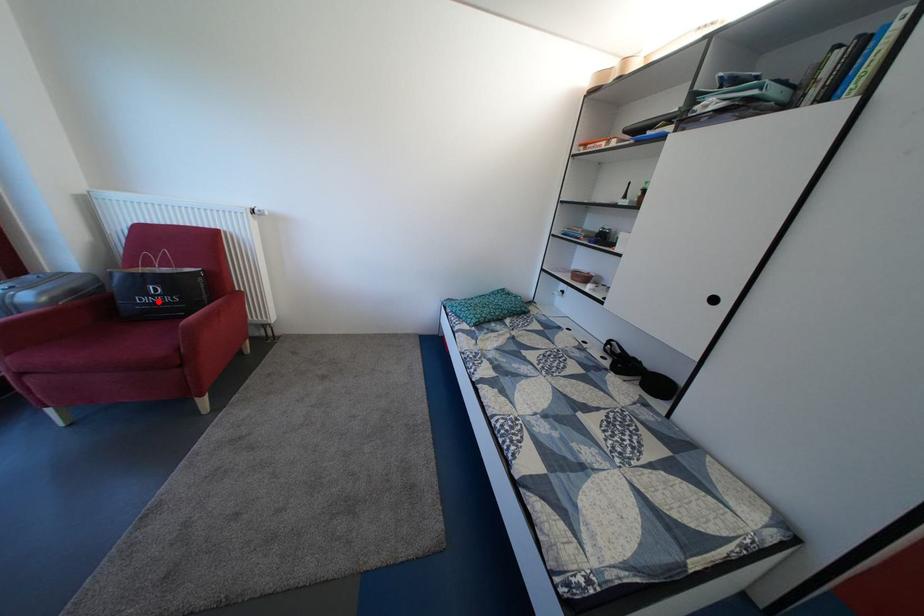
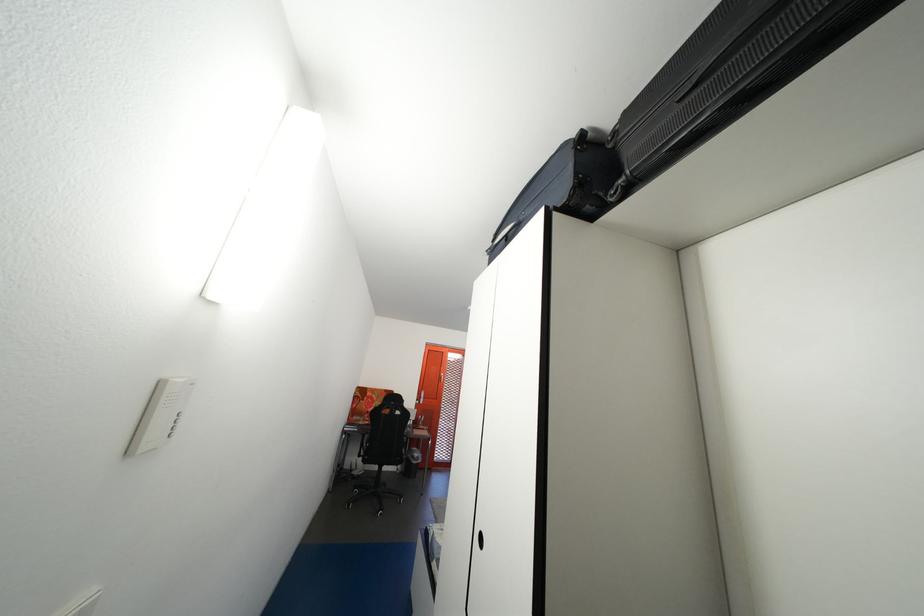
Question: I am providing you with two images of the same scene from different viewpoints. A red point is marked on the first image. Can you still see the location of the red point in image 2?

Choices:
 (A) Yes
 (B) No

Answer: (B)